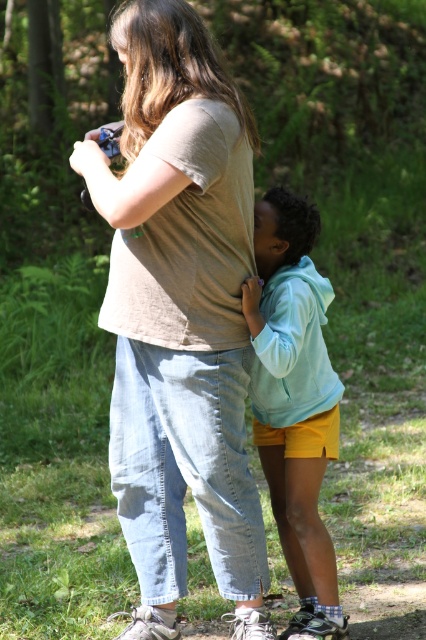
You are a photographer trying to capture a candid shot of the two people in the scene. You want to ensure that both the matte brown shirt at center and the light blue fleece jacket at center are clearly visible in your frame. Based on their positions, which direction should you adjust your camera to keep both subjects in view?

The matte brown shirt at center is positioned on the left side of light blue fleece jacket at center, so you should adjust your camera slightly to the left to ensure both subjects remain in view.

You are standing at the center of the scene and see a point marked at coordinates (180,314). Which object is this point located on?

The point at coordinates (180,314) is located on the matte brown shirt at center.